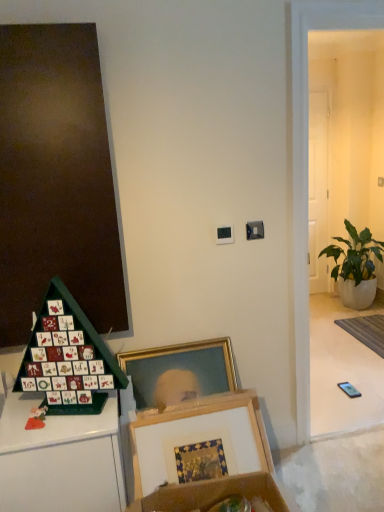
Question: Is green leafy plant in white pot at right facing towards wooden picture frame at lower center?

Choices:
 (A) yes
 (B) no

Answer: (B)

Question: Considering the relative positions of green leafy plant in white pot at right and wooden picture frame at lower center in the image provided, is green leafy plant in white pot at right to the left of wooden picture frame at lower center from the viewer's perspective?

Choices:
 (A) no
 (B) yes

Answer: (A)

Question: From the image's perspective, is green leafy plant in white pot at right under wooden picture frame at lower center?

Choices:
 (A) yes
 (B) no

Answer: (B)

Question: From the image's perspective, is green leafy plant in white pot at right on top of wooden picture frame at lower center?

Choices:
 (A) yes
 (B) no

Answer: (A)

Question: Would you say green leafy plant in white pot at right contains wooden picture frame at lower center?

Choices:
 (A) yes
 (B) no

Answer: (B)

Question: Is green leafy plant in white pot at right taller than wooden picture frame at lower center?

Choices:
 (A) no
 (B) yes

Answer: (B)

Question: From a real-world perspective, does gray woven mat at lower right sit lower than wooden picture frame at lower center?

Choices:
 (A) no
 (B) yes

Answer: (B)

Question: Is gray woven mat at lower right wider than wooden picture frame at lower center?

Choices:
 (A) yes
 (B) no

Answer: (A)

Question: Can you confirm if gray woven mat at lower right is positioned to the left of wooden picture frame at lower center?

Choices:
 (A) yes
 (B) no

Answer: (B)

Question: Is gray woven mat at lower right bigger than wooden picture frame at lower center?

Choices:
 (A) yes
 (B) no

Answer: (B)

Question: Is gray woven mat at lower right directly adjacent to wooden picture frame at lower center?

Choices:
 (A) no
 (B) yes

Answer: (A)

Question: Is gray woven mat at lower right shorter than wooden picture frame at lower center?

Choices:
 (A) no
 (B) yes

Answer: (B)

Question: Can you confirm if gray woven mat at lower right is positioned to the right of green leafy plant in white pot at right?

Choices:
 (A) no
 (B) yes

Answer: (B)